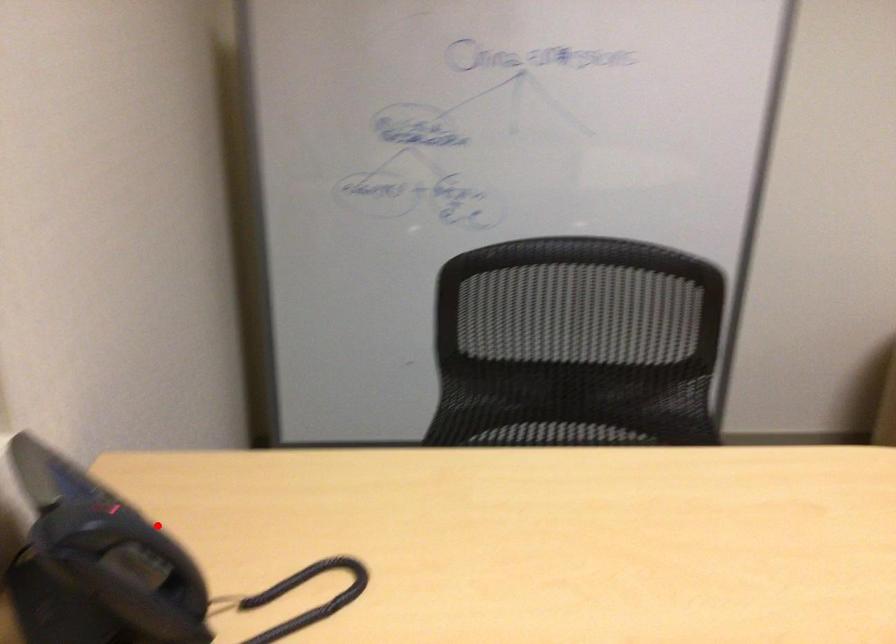
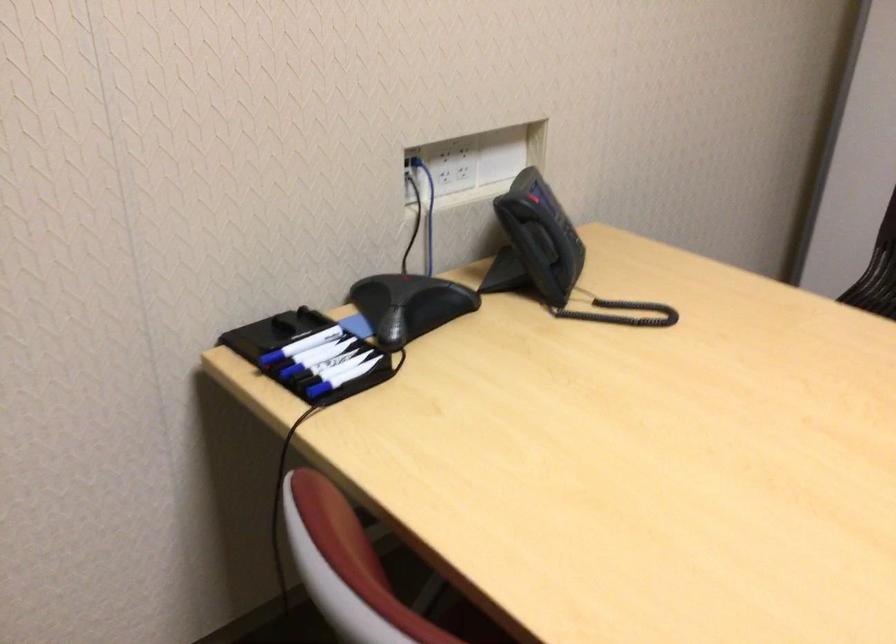
Question: A red point is marked in image1. In image2, is the corresponding 3D point closer to the camera or farther? Reply with the corresponding letter.

Choices:
 (A) The corresponding 3D point is closer.
 (B) The corresponding 3D point is farther.

Answer: (B)